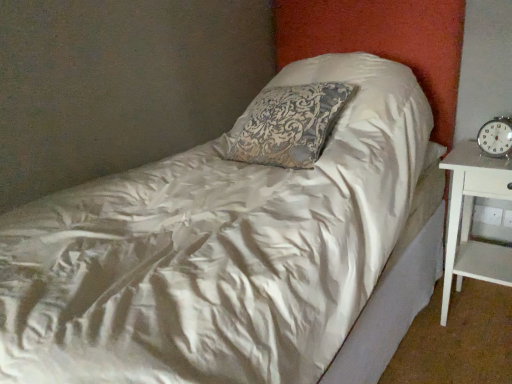
Question: Is white wood nightstand at right facing towards metallic silver clock at right?

Choices:
 (A) yes
 (B) no

Answer: (B)

Question: Is metallic silver clock at right completely or partially inside white wood nightstand at right?

Choices:
 (A) yes
 (B) no

Answer: (B)

Question: From the image's perspective, is white wood nightstand at right under metallic silver clock at right?

Choices:
 (A) no
 (B) yes

Answer: (B)

Question: Does white wood nightstand at right have a lesser width compared to metallic silver clock at right?

Choices:
 (A) yes
 (B) no

Answer: (B)

Question: Would you say white wood nightstand at right is a long distance from metallic silver clock at right?

Choices:
 (A) yes
 (B) no

Answer: (B)

Question: Is white wood nightstand at right positioned beyond the bounds of metallic silver clock at right?

Choices:
 (A) no
 (B) yes

Answer: (B)

Question: Is metallic silver clock at right thinner than white wood nightstand at right?

Choices:
 (A) no
 (B) yes

Answer: (B)

Question: From the image's perspective, is metallic silver clock at right located beneath white wood nightstand at right?

Choices:
 (A) no
 (B) yes

Answer: (A)

Question: Considering the relative sizes of metallic silver clock at right and white wood nightstand at right in the image provided, is metallic silver clock at right bigger than white wood nightstand at right?

Choices:
 (A) no
 (B) yes

Answer: (A)

Question: Does metallic silver clock at right have a greater height compared to white wood nightstand at right?

Choices:
 (A) yes
 (B) no

Answer: (B)

Question: Does metallic silver clock at right have a smaller size compared to white wood nightstand at right?

Choices:
 (A) yes
 (B) no

Answer: (A)

Question: Is metallic silver clock at right positioned in front of white wood nightstand at right?

Choices:
 (A) yes
 (B) no

Answer: (B)

Question: In terms of width, does metallic silver clock at right look wider or thinner when compared to white wood nightstand at right?

Choices:
 (A) thin
 (B) wide

Answer: (A)